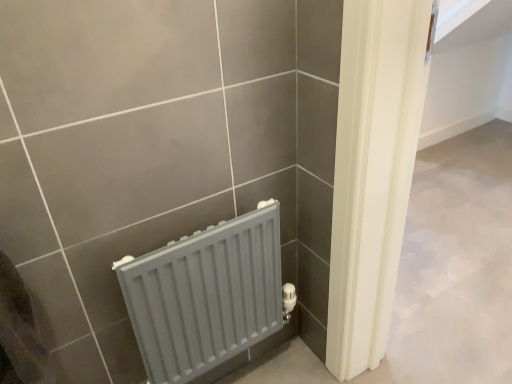
Question: Considering the relative sizes of matte plastic towel at lower left and gray matte radiator at lower left in the image provided, is matte plastic towel at lower left wider than gray matte radiator at lower left?

Choices:
 (A) yes
 (B) no

Answer: (A)

Question: Does matte plastic towel at lower left come in front of gray matte radiator at lower left?

Choices:
 (A) no
 (B) yes

Answer: (B)

Question: Is matte plastic towel at lower left oriented towards gray matte radiator at lower left?

Choices:
 (A) yes
 (B) no

Answer: (B)

Question: Is matte plastic towel at lower left looking in the opposite direction of gray matte radiator at lower left?

Choices:
 (A) no
 (B) yes

Answer: (A)

Question: From the image's perspective, is matte plastic towel at lower left under gray matte radiator at lower left?

Choices:
 (A) yes
 (B) no

Answer: (B)

Question: Considering the relative sizes of matte plastic towel at lower left and gray matte radiator at lower left in the image provided, is matte plastic towel at lower left taller than gray matte radiator at lower left?

Choices:
 (A) yes
 (B) no

Answer: (B)

Question: Considering the relative sizes of gray matte radiator at lower left and matte plastic towel at lower left in the image provided, is gray matte radiator at lower left smaller than matte plastic towel at lower left?

Choices:
 (A) no
 (B) yes

Answer: (A)

Question: Does gray matte radiator at lower left contain matte plastic towel at lower left?

Choices:
 (A) yes
 (B) no

Answer: (B)

Question: Is gray matte radiator at lower left shorter than matte plastic towel at lower left?

Choices:
 (A) yes
 (B) no

Answer: (B)

Question: From a real-world perspective, does gray matte radiator at lower left sit lower than matte plastic towel at lower left?

Choices:
 (A) no
 (B) yes

Answer: (B)

Question: From a real-world perspective, is gray matte radiator at lower left on top of matte plastic towel at lower left?

Choices:
 (A) no
 (B) yes

Answer: (A)

Question: Can you confirm if gray matte radiator at lower left is positioned to the right of matte plastic towel at lower left?

Choices:
 (A) yes
 (B) no

Answer: (A)

Question: From the image's perspective, is matte plastic towel at lower left located above or below gray matte radiator at lower left?

Choices:
 (A) above
 (B) below

Answer: (A)